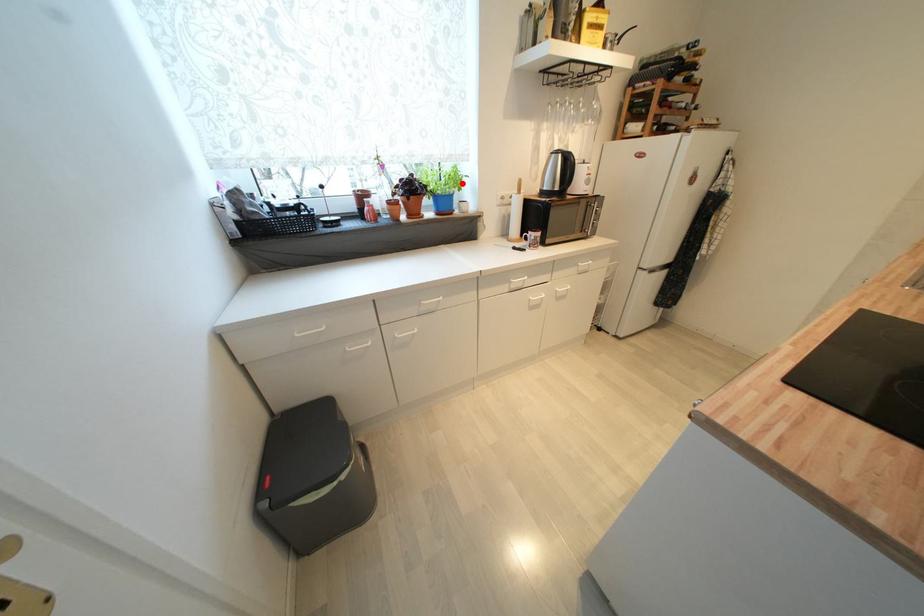
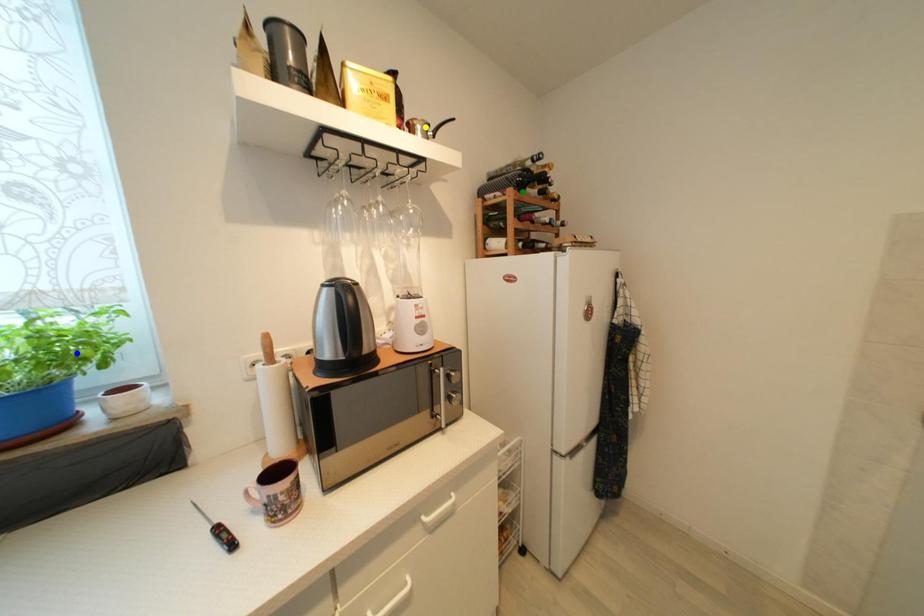
Question: I am providing you with two images of the same scene from different viewpoints. A red point is marked on the first image. You are given multiple points on the second image. In image 2, which mark is for the same physical point as the one in image 1?

Choices:
 (A) green point
 (B) blue point
 (C) yellow point

Answer: (B)